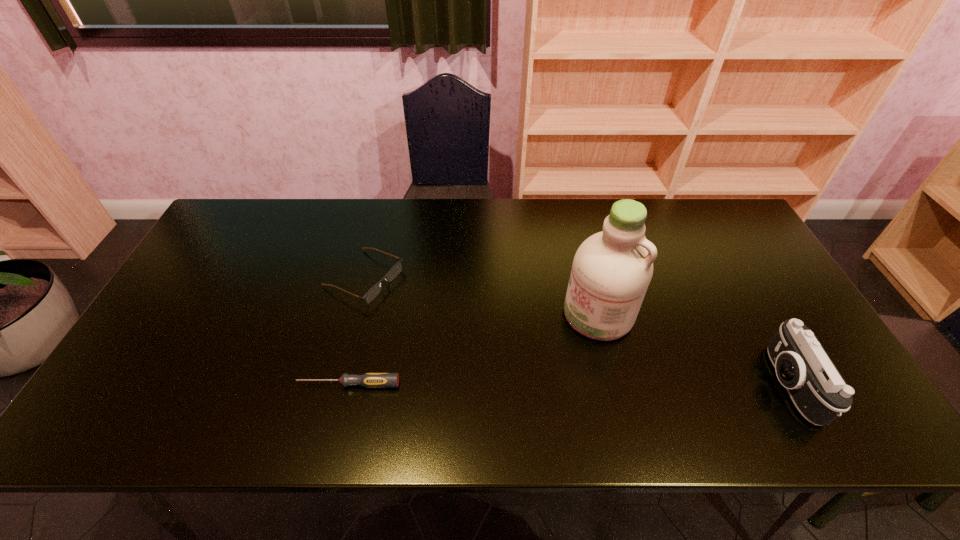
Where is `object present at the right edge`? This screenshot has height=540, width=960. object present at the right edge is located at coordinates (819, 392).

The width and height of the screenshot is (960, 540). I want to click on object at the near right corner, so click(x=819, y=392).

Where is `vacant space at the far edge`? The width and height of the screenshot is (960, 540). vacant space at the far edge is located at coordinates (420, 204).

Where is `blank area at the near edge`? blank area at the near edge is located at coordinates (320, 369).

Locate an element on the screen. The height and width of the screenshot is (540, 960). vacant region at the left edge of the desktop is located at coordinates (220, 262).

What are the coordinates of `vacant space at the right edge` in the screenshot? It's located at (734, 280).

Where is `free space at the far right corner`? The height and width of the screenshot is (540, 960). free space at the far right corner is located at coordinates (722, 217).

Locate an element on the screen. The width and height of the screenshot is (960, 540). free space between the shortest object and the cleansing agent is located at coordinates (473, 349).

Where is `empty location between the spectacles and the shortest object`? The width and height of the screenshot is (960, 540). empty location between the spectacles and the shortest object is located at coordinates (356, 330).

Where is `free space that is in between the third tallest object and the screwdriver`? free space that is in between the third tallest object and the screwdriver is located at coordinates (356, 330).